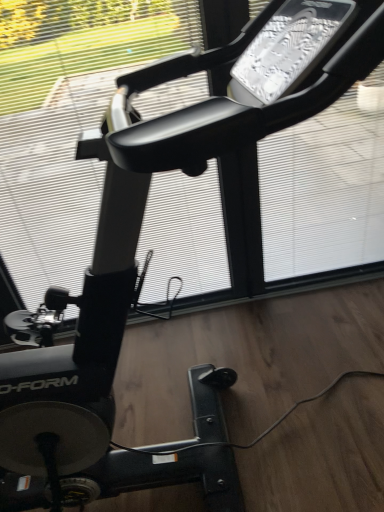
Question: From the image's perspective, is transparent plastic window screen at upper center, which is the second window screen in left-to-right order, located above or below white matte window screen at center, which ranks as the first window screen in left-to-right order?

Choices:
 (A) above
 (B) below

Answer: (A)

Question: From a real-world perspective, is transparent plastic window screen at upper center, which is the second window screen in left-to-right order, positioned above or below white matte window screen at center, which ranks as the first window screen in left-to-right order?

Choices:
 (A) below
 (B) above

Answer: (A)

Question: From their relative heights in the image, would you say transparent plastic window screen at upper center, placed as the 1th window screen when sorted from right to left, is taller or shorter than white matte window screen at center, which ranks as the first window screen in left-to-right order?

Choices:
 (A) short
 (B) tall

Answer: (A)

Question: Would you say white matte window screen at center, which ranks as the first window screen in left-to-right order, is to the left or to the right of transparent plastic window screen at upper center, placed as the 1th window screen when sorted from right to left, in the picture?

Choices:
 (A) right
 (B) left

Answer: (B)

Question: Looking at their shapes, would you say white matte window screen at center, which ranks as the first window screen in left-to-right order, is wider or thinner than transparent plastic window screen at upper center, which is the second window screen in left-to-right order?

Choices:
 (A) thin
 (B) wide

Answer: (A)

Question: From their relative heights in the image, would you say white matte window screen at center, acting as the second window screen starting from the right, is taller or shorter than transparent plastic window screen at upper center, placed as the 1th window screen when sorted from right to left?

Choices:
 (A) tall
 (B) short

Answer: (A)

Question: Is point (105, 81) closer or farther from the camera than point (331, 189)?

Choices:
 (A) closer
 (B) farther

Answer: (A)